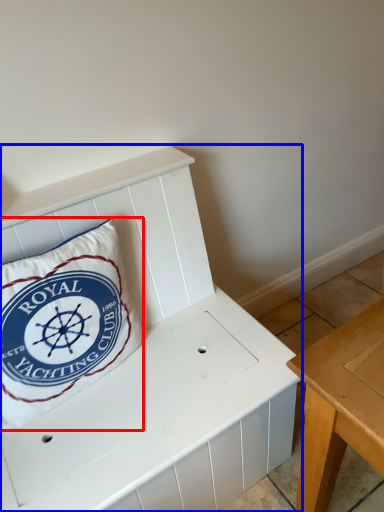
Question: Which point is further to the camera, pillow (highlighted by a red box) or furniture (highlighted by a blue box)?

Choices:
 (A) pillow
 (B) furniture

Answer: (A)